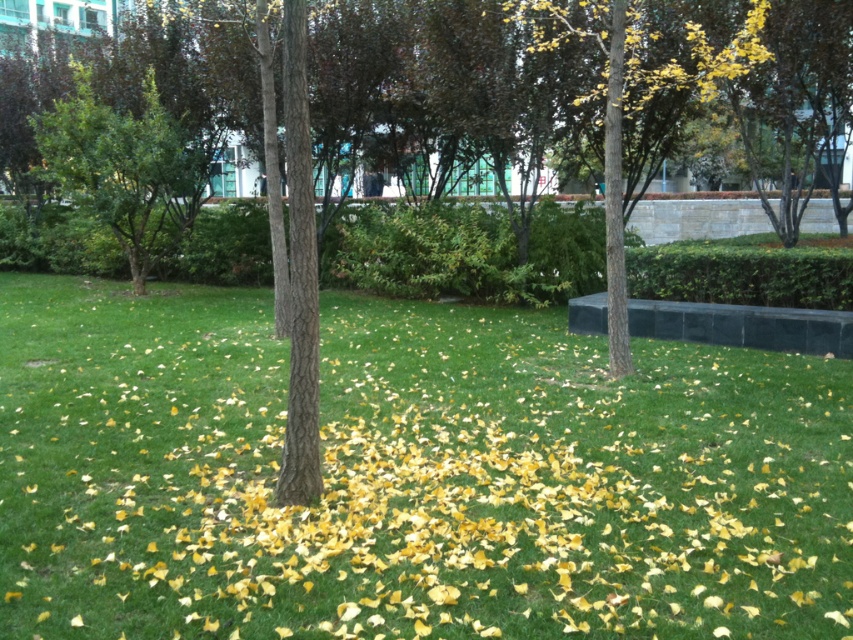
You are standing in the park and want to take a photo of the green leafy tree at left. If your camera has a maximum focus range of 12 meters, will it be able to capture the tree clearly?

The distance between you and the green leafy tree at left is 12.57 meters, which exceeds the camera maximum focus range of 12 meters. Therefore, the camera cannot capture the tree clearly.

You are standing in the park and see the yellow leaf litter at center and the green leafy tree at left. Which object is located to the right of the other?

The yellow leaf litter at center is positioned on the right side of green leafy tree at left.